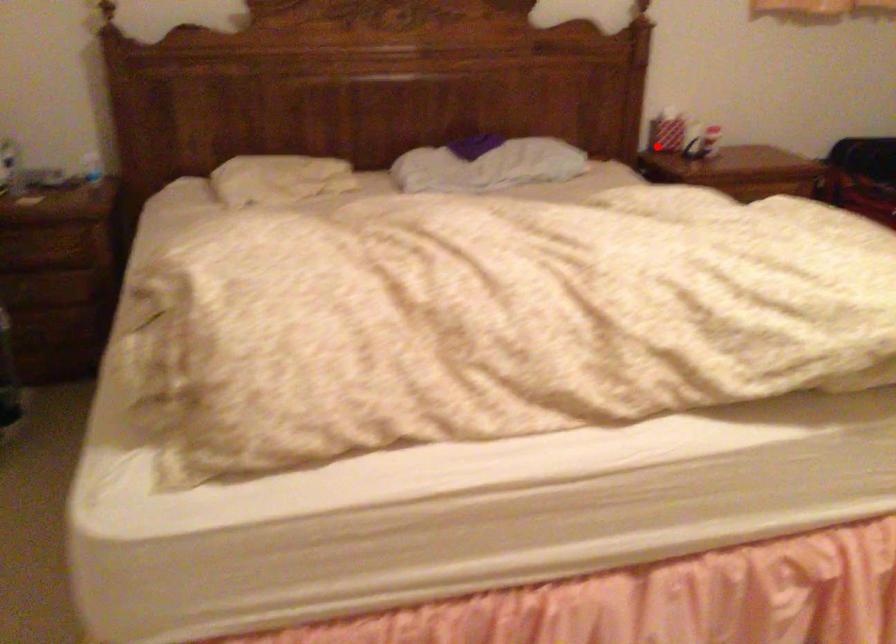
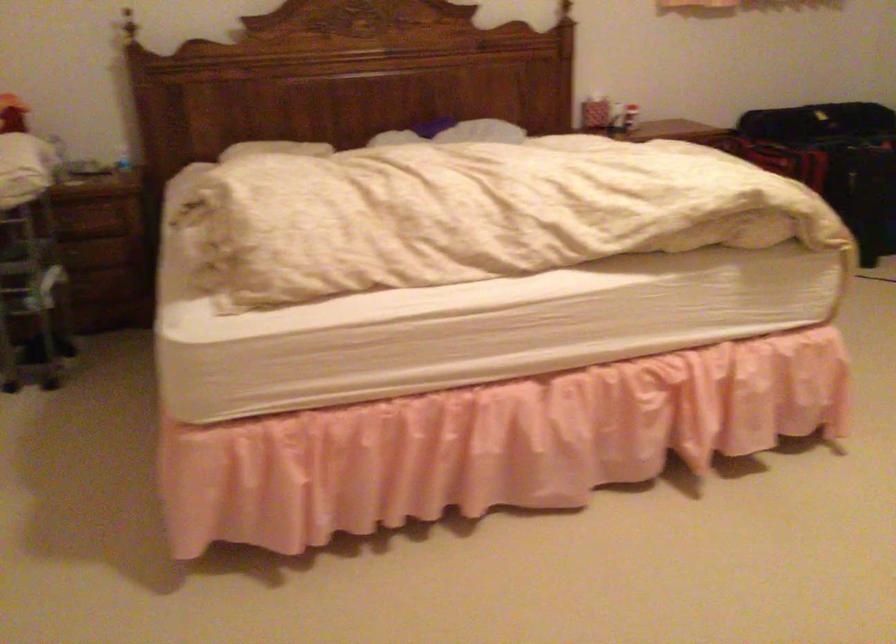
Question: I am providing you with two images of the same scene from different viewpoints. Given a red point in image1, look at the same physical point in image2. Is it:

Choices:
 (A) Closer to the viewpoint
 (B) Farther from the viewpoint

Answer: (B)